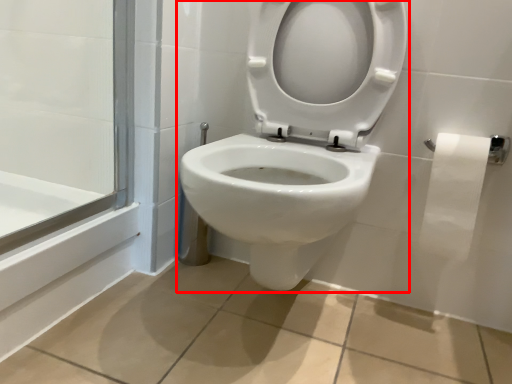
Question: From the image's perspective, considering the relative positions of toilet (annotated by the red box) and toilet paper in the image provided, where is toilet (annotated by the red box) located with respect to the staircase?

Choices:
 (A) below
 (B) above

Answer: (B)